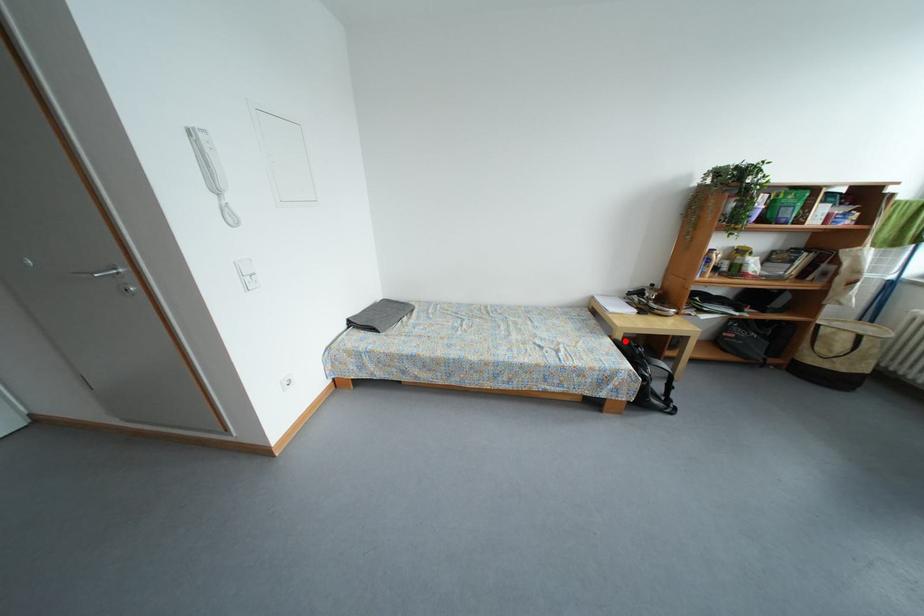
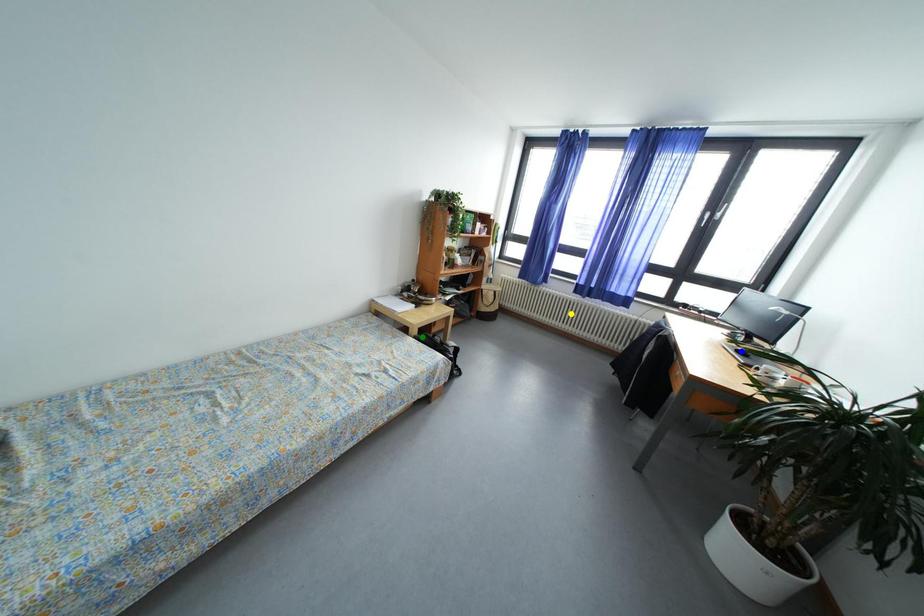
Question: I am providing you with two images of the same scene from different viewpoints. A red point is marked on the first image. You are given multiple points on the second image. Can you choose the point in image 2 that corresponds to the point in image 1?

Choices:
 (A) yellow point
 (B) blue point
 (C) green point

Answer: (C)